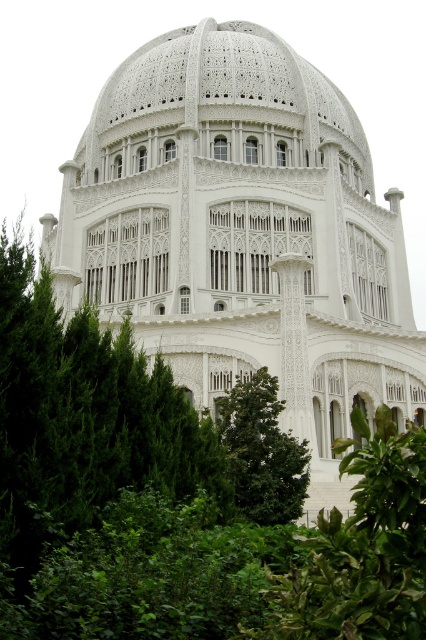
Question: Considering the relative positions of white stone dome at center and green leafy tree at center in the image provided, where is white stone dome at center located with respect to green leafy tree at center?

Choices:
 (A) right
 (B) left

Answer: (B)

Question: Is white stone dome at center closer to camera compared to white carved dome at center?

Choices:
 (A) no
 (B) yes

Answer: (B)

Question: Based on their relative distances, which object is farther from the green leafy tree at center?

Choices:
 (A) white carved dome at center
 (B) white stone dome at center

Answer: (A)

Question: Based on their relative distances, which object is farther from the white carved dome at center?

Choices:
 (A) white stone dome at center
 (B) green leafy tree at center

Answer: (B)

Question: Does white stone dome at center appear on the right side of white carved dome at center?

Choices:
 (A) no
 (B) yes

Answer: (A)

Question: Which point is farther to the camera?

Choices:
 (A) green leafy tree at center
 (B) white stone dome at center

Answer: (B)